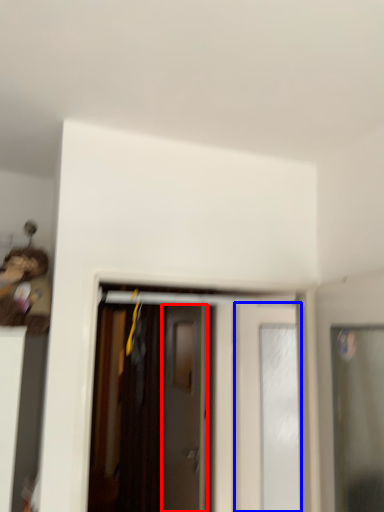
Question: Which of the following is the closest to the observer, door (highlighted by a red box) or door (highlighted by a blue box)?

Choices:
 (A) door
 (B) door

Answer: (B)